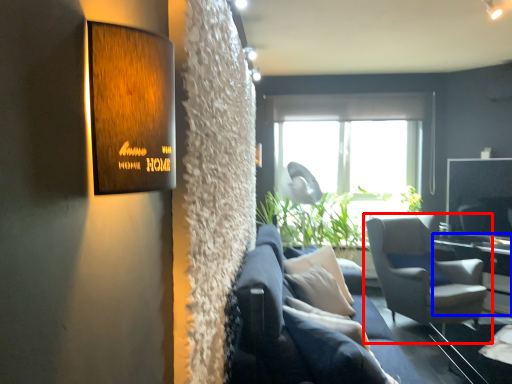
Question: Which object appears farthest to the camera in this image, chair (highlighted by a red box) or table (highlighted by a blue box)?

Choices:
 (A) chair
 (B) table

Answer: (B)